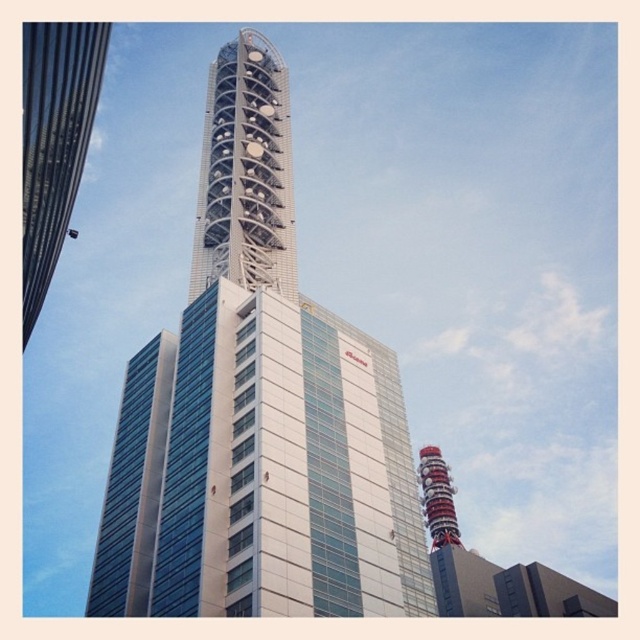
Question: Does white glass tower at center have a greater width compared to white metallic tower at center?

Choices:
 (A) yes
 (B) no

Answer: (A)

Question: Can you confirm if white glass tower at center is wider than glassy steel skyscraper at left?

Choices:
 (A) yes
 (B) no

Answer: (A)

Question: Which point is farther to the camera?

Choices:
 (A) glassy steel skyscraper at left
 (B) white metallic tower at center
 (C) white glass tower at center

Answer: (B)

Question: Does white metallic tower at center have a lesser width compared to glassy steel skyscraper at left?

Choices:
 (A) yes
 (B) no

Answer: (A)

Question: Which object is positioned farthest from the white glass tower at center?

Choices:
 (A) white metallic tower at center
 (B) glassy steel skyscraper at left

Answer: (B)

Question: Which of these objects is positioned farthest from the white glass tower at center?

Choices:
 (A) white metallic tower at center
 (B) glassy steel skyscraper at left

Answer: (B)